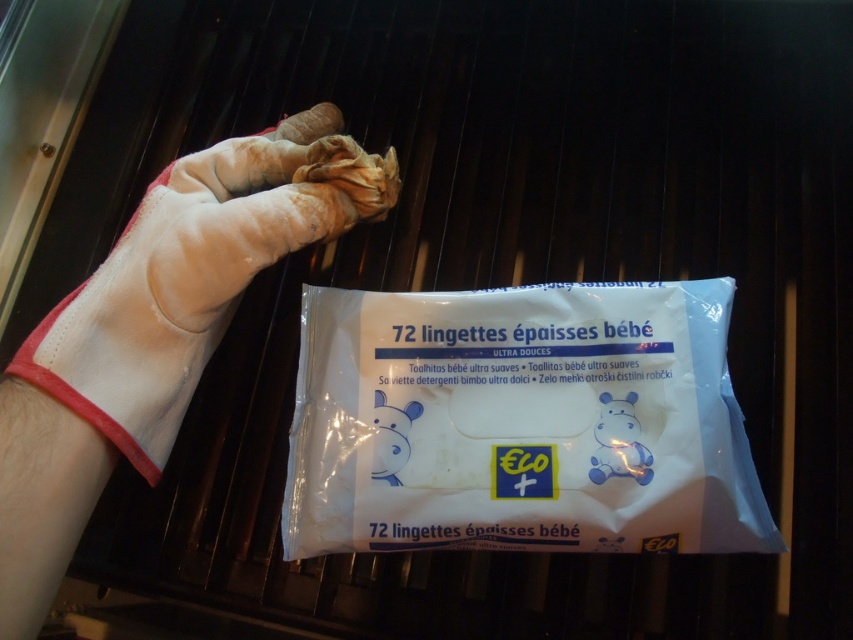
Describe the element at coordinates (520, 422) in the screenshot. Image resolution: width=853 pixels, height=640 pixels. I see `white plastic wipes at center` at that location.

Does white plastic wipes at center have a larger size compared to white leather glove at upper left?

No.

Locate an element on the screen. Image resolution: width=853 pixels, height=640 pixels. white plastic wipes at center is located at coordinates (520, 422).